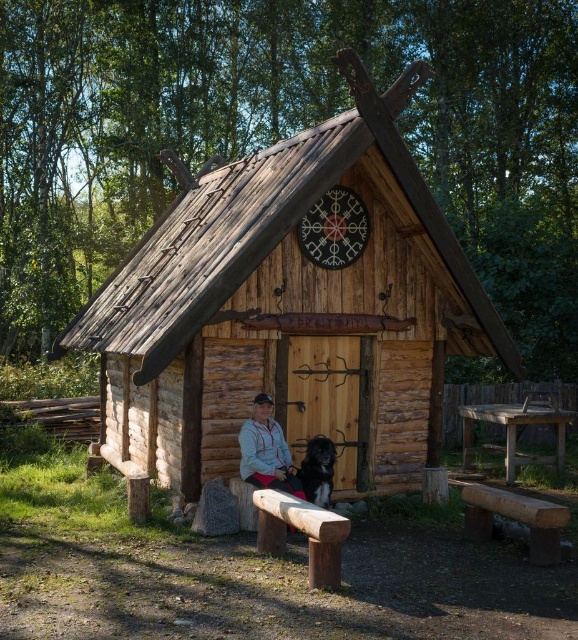
You are standing in front of the Viking longhouse and want to take a photo. You notice two points marked on the structure. Which point, point (524,506) or point (305,477), is closer to your camera position?

Point (524,506) is closer to the camera than point (305,477).

You are standing at the entrance of the Viking longhouse and notice two points marked on the structure. Which point, point [329,572] or point [518,500], is closer to you?

Point [329,572] is closer to the viewer than point [518,500].

You are a visitor approaching the Viking longhouse and need to sit down for a moment. You see the smooth wooden bench at lower right and the black fur dog at lower center. Which object is shorter, making it a better option for sitting?

The smooth wooden bench at lower right has a lesser height compared to the black fur dog at lower center, so it is shorter and a better option for sitting.